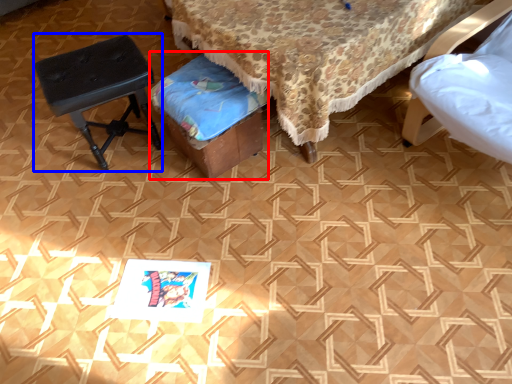
Question: Among these objects, which one is farthest to the camera, music stool (highlighted by a red box) or stool (highlighted by a blue box)?

Choices:
 (A) music stool
 (B) stool

Answer: (B)